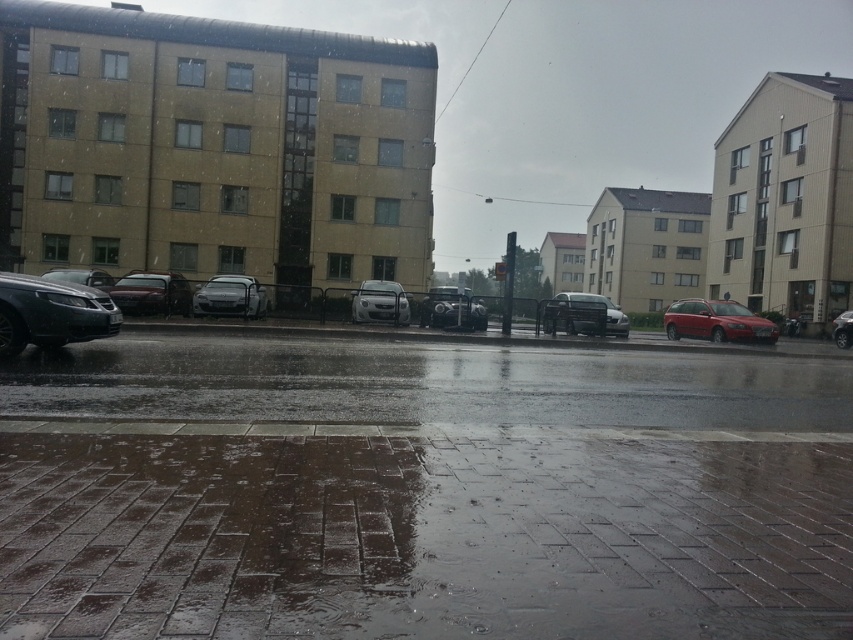
Question: Among these objects, which one is nearest to the camera?

Choices:
 (A) shiny red car at center
 (B) satin silver sedan at left

Answer: (B)

Question: Is satin silver sedan at center below metallic silver sedan at center?

Choices:
 (A) no
 (B) yes

Answer: (A)

Question: Can you confirm if shiny metallic car at center is positioned to the left of metallic silver sedan at center?

Choices:
 (A) yes
 (B) no

Answer: (A)

Question: Which point is farther from the camera taking this photo?

Choices:
 (A) (393, 294)
 (B) (573, 307)
 (C) (59, 330)

Answer: (A)

Question: Is shiny red car at center to the right of metallic silver sedan at center from the viewer's perspective?

Choices:
 (A) yes
 (B) no

Answer: (B)

Question: Which of the following is the closest to the observer?

Choices:
 (A) shiny red car at center
 (B) wet brick pavement at center
 (C) metallic silver van at center
 (D) satin silver sedan at center

Answer: (B)